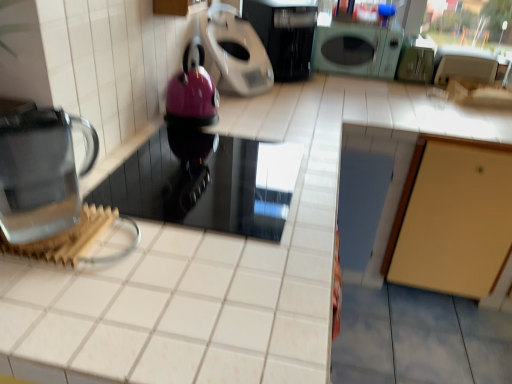
This screenshot has width=512, height=384. Find the location of `vacant area that lies in front of metallic silver scale at upper center, positioned as the 1th kitchen appliance in left-to-right order`. vacant area that lies in front of metallic silver scale at upper center, positioned as the 1th kitchen appliance in left-to-right order is located at coordinates (257, 109).